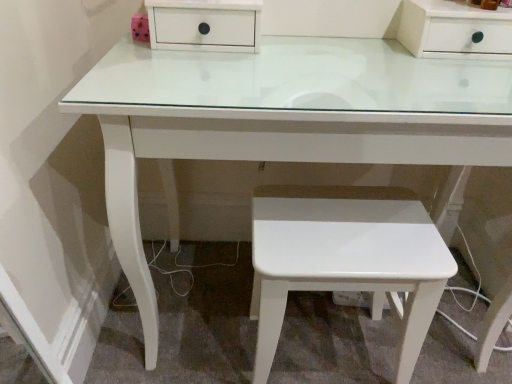
Where is `white glossy stool at lower center`? The height and width of the screenshot is (384, 512). white glossy stool at lower center is located at coordinates (346, 258).

What do you see at coordinates (346, 258) in the screenshot? I see `white glossy stool at lower center` at bounding box center [346, 258].

Identify the location of white glossy stool at lower center. (346, 258).